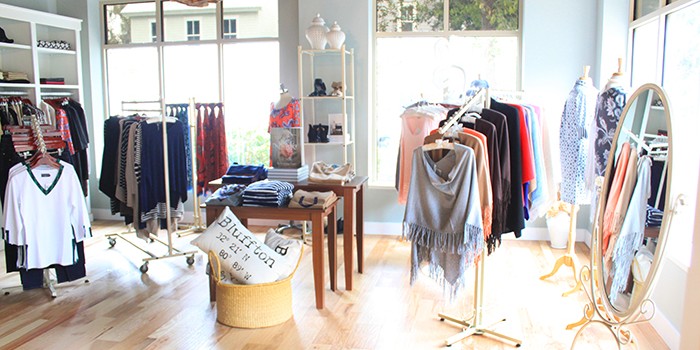
Where is `pillows in basket`? This screenshot has width=700, height=350. pillows in basket is located at coordinates (245, 248).